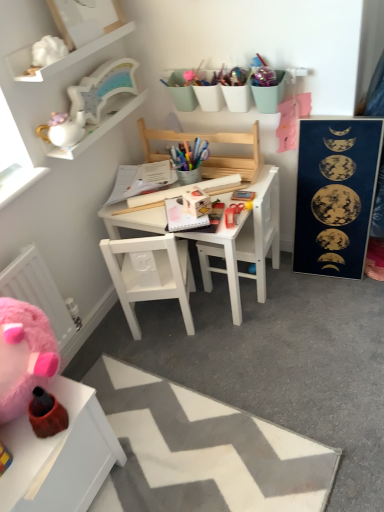
This screenshot has height=512, width=384. I want to click on vacant area that is in front of white wooden changing table at center, so (263, 322).